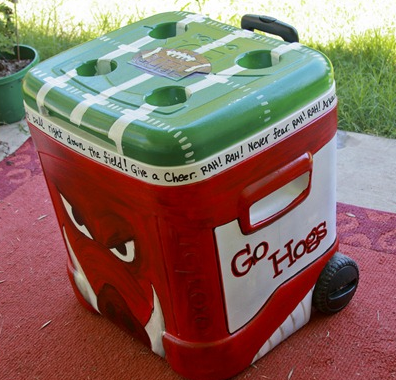
You are a GUI agent. You are given a task and a screenshot of the screen. Output one action in this format:
    pyautogui.click(x=<x>, y=<y>)
    Task: Click on the cup holder
    The width and height of the screenshot is (396, 380).
    Given the screenshot: What is the action you would take?
    pyautogui.click(x=166, y=100), pyautogui.click(x=250, y=70), pyautogui.click(x=167, y=24), pyautogui.click(x=90, y=79)